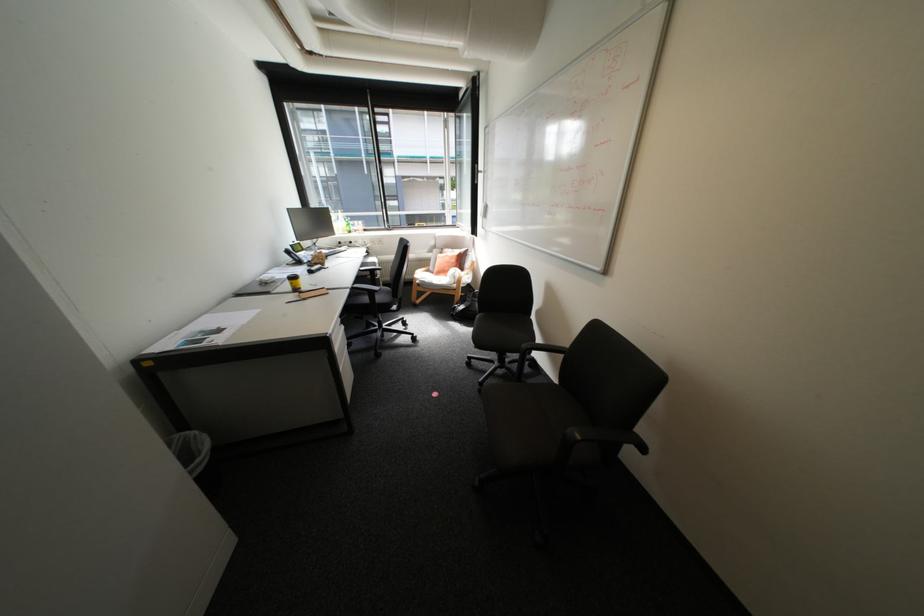
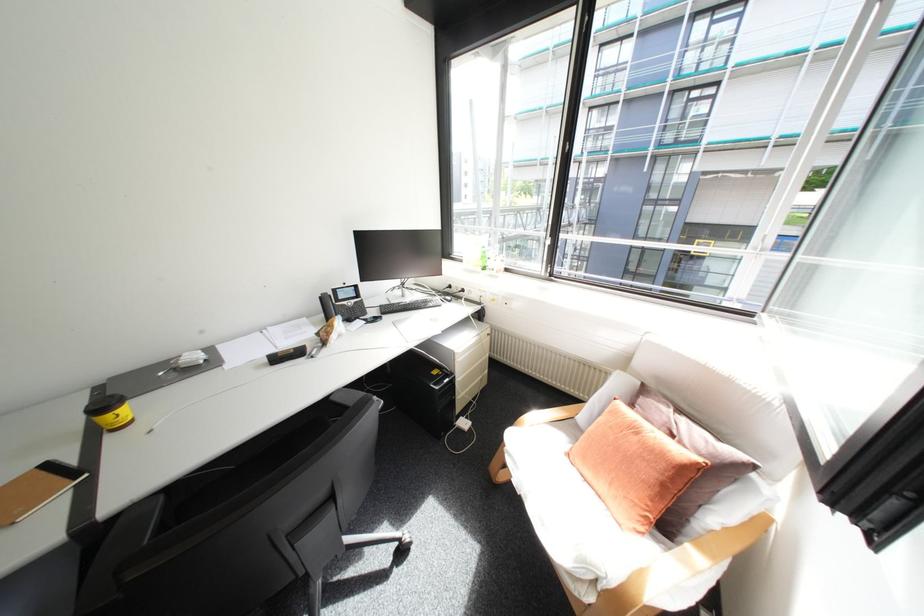
Find the pixel in the second image that matches point (317, 273) in the first image.

(275, 361)